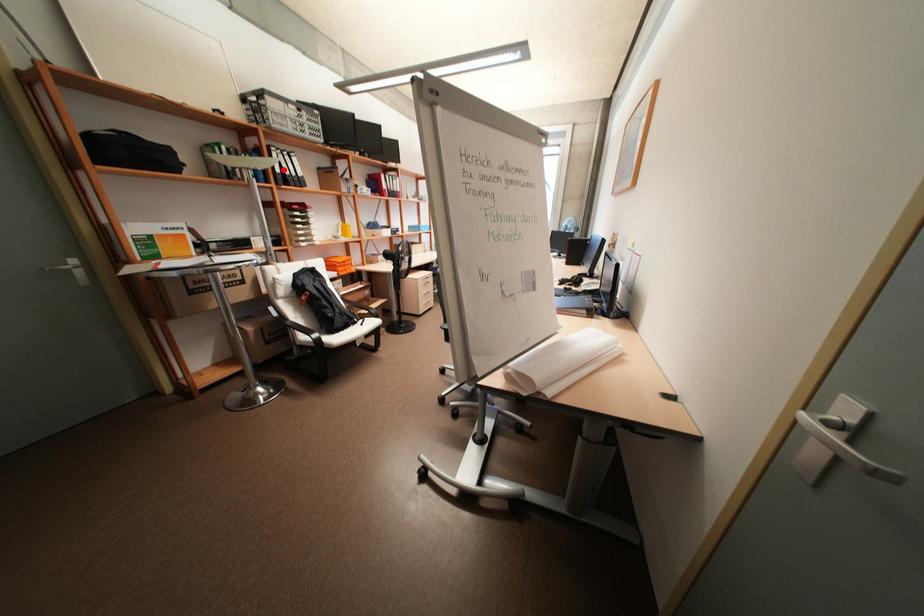
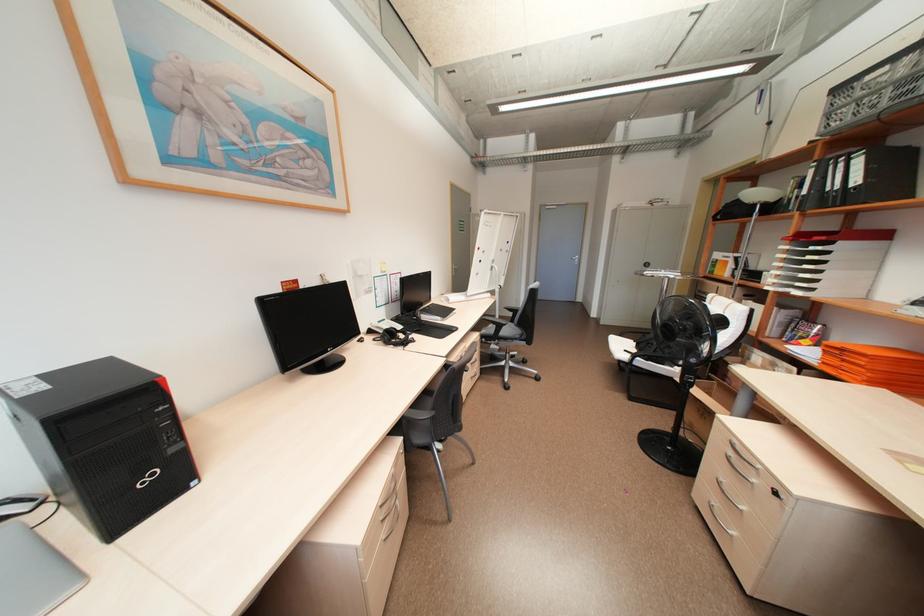
The point at the highlighted location is marked in the first image. Where is the corresponding point in the second image?

(810, 191)